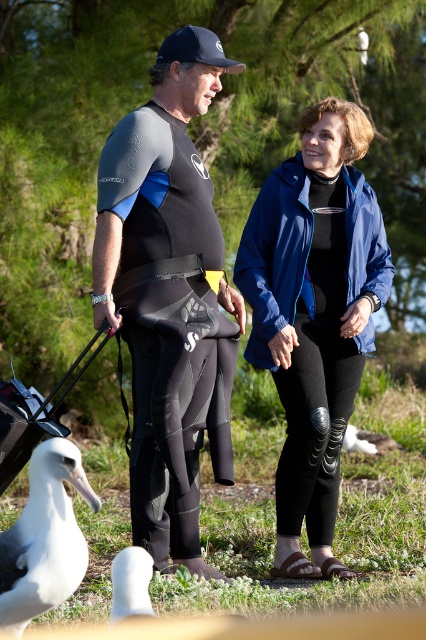
Question: Is black neoprene wetsuit at center positioned at the back of white matte bird at lower left?

Choices:
 (A) no
 (B) yes

Answer: (B)

Question: Is the position of blue matte jacket at center less distant than that of white matte bird at lower left?

Choices:
 (A) yes
 (B) no

Answer: (B)

Question: Which object is positioned farthest from the black neoprene wetsuit at center?

Choices:
 (A) white matte bird at lower left
 (B) blue matte jacket at center
 (C) black rubber baby carriage at lower left
 (D) white matte mollymawk at lower left

Answer: (A)

Question: Which is farther from the black neoprene wetsuit at center?

Choices:
 (A) white matte mollymawk at lower left
 (B) white matte bird at lower left

Answer: (B)

Question: In this image, where is black neoprene wetsuit at center located relative to blue matte jacket at center?

Choices:
 (A) left
 (B) right

Answer: (A)

Question: Estimate the real-world distances between objects in this image. Which object is farther from the blue matte jacket at center?

Choices:
 (A) black rubber baby carriage at lower left
 (B) white matte mollymawk at lower left

Answer: (B)